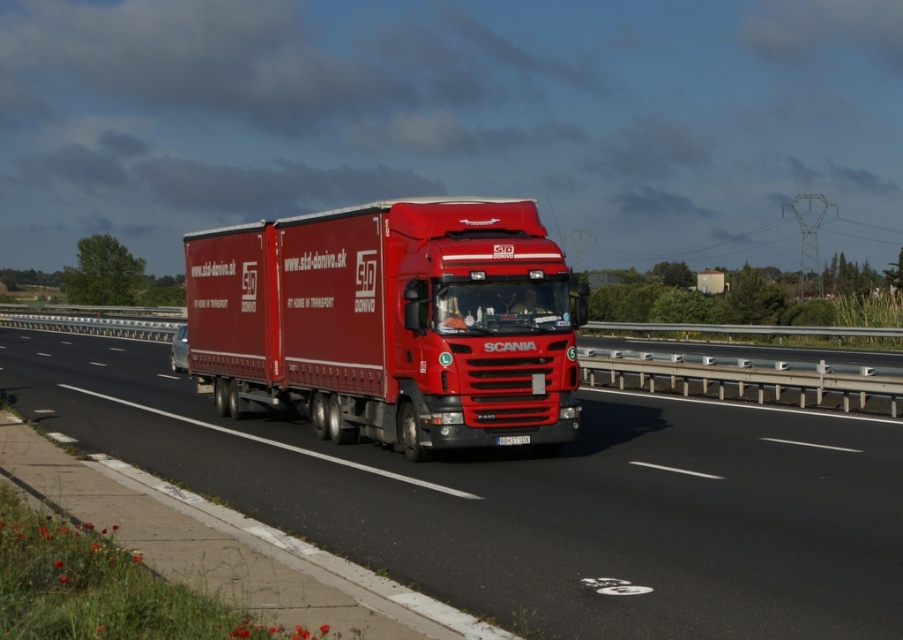
You are a passenger in the red Scania G10 truck driving on the highway. You notice two points marked on the road ahead. The first point is at coordinates point (775, 529) and the second is at point (511, 435). Which point will you reach first as the truck continues moving forward?

Point (775, 529) is closer to the viewer than point (511, 435), so you will reach point (775, 529) first as the truck moves forward.

You are a delivery driver who needs to pass under a low bridge that has a height restriction sign indicating 3.5 meters. You are driving the matte red truck at center with its attached matte red trailer truck at center. Which part of your vehicle should you be more concerned about hitting the bridge? Explain your reasoning.

The matte red trailer truck at center is taller than the matte red truck at center. Since the trailer is taller, it is more likely to hit the bridge first, so you should be more concerned about the matte red trailer truck at center.

You are a traffic officer assessing vehicle dimensions. The highway has a maximum width limit of 2.5 meters for vehicles. Given that the white plastic license plate at center is 0.3 meters wide, can the matte red trailer truck at center legally pass through the highway without violating the width restriction?

The matte red trailer truck at center might be wider than the white plastic license plate at center. Since the license plate is 0.3 meters wide, if the truck exceeds 2.5 meters, it would violate the width limit. However, without exact measurements, we cannot confirm if it complies.